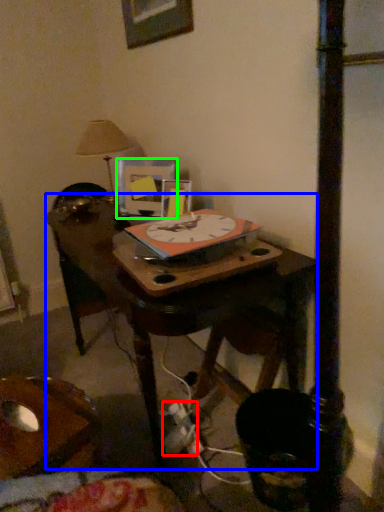
Question: Which object is positioned farthest from plug (highlighted by a red box)? Select from table (highlighted by a blue box) and picture frame (highlighted by a green box).

Choices:
 (A) table
 (B) picture frame

Answer: (B)